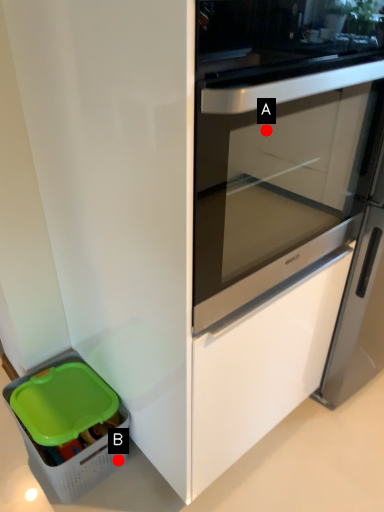
Question: Two points are circled on the image, labeled by A and B beside each circle. Among these points, which one is nearest to the camera?

Choices:
 (A) A is closer
 (B) B is closer

Answer: (B)